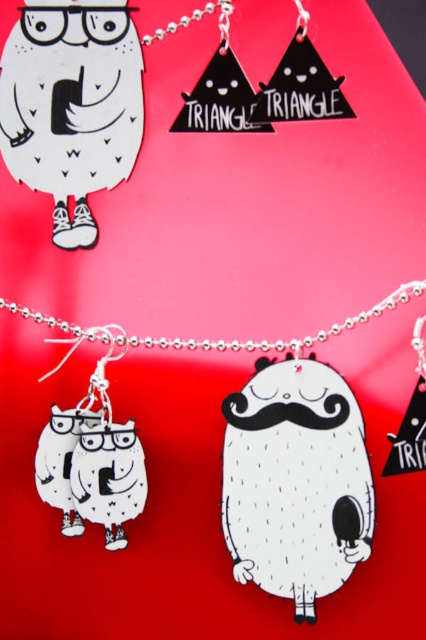
Consider the image. Between white matte owl at center and matte black owl at lower left, which one is positioned higher?

white matte owl at center is above.

Who is lower down, white matte owl at center or matte black owl at lower left?

matte black owl at lower left

Identify the location of white matte owl at center. (296, 481).

Which is more to the left, matte black owl at lower left or silver metallic chain at upper left?

From the viewer's perspective, matte black owl at lower left appears more on the left side.

The height and width of the screenshot is (640, 426). What are the coordinates of `matte black owl at lower left` in the screenshot? It's located at (109, 477).

Is silver metallic chain at center to the left of white glossy owl at left from the viewer's perspective?

No, silver metallic chain at center is not to the left of white glossy owl at left.

Based on the photo, between silver metallic chain at center and white glossy owl at left, which one has more height?

With more height is white glossy owl at left.

Between point (109, 324) and point (88, 419), which one is positioned behind?

Point (109, 324)

Image resolution: width=426 pixels, height=640 pixels. I want to click on silver metallic chain at center, so click(206, 339).